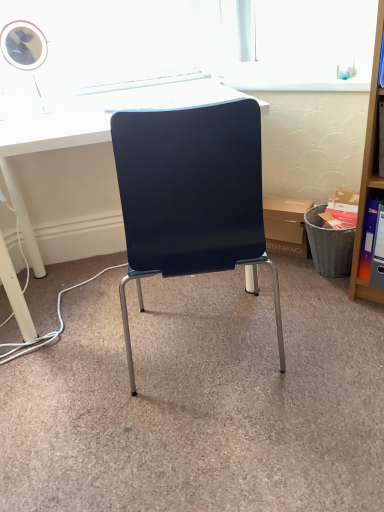
Measure the distance between wooden shelf at right and camera.

wooden shelf at right is 4.63 feet from camera.

Find the location of a particular element. white glossy desk at center is located at coordinates (103, 117).

Find the location of a particular element. wooden shelf at right is located at coordinates (369, 170).

What are the coordinates of `book above the matte cardboard box at center (from a real-world perspective)` in the screenshot? It's located at (369, 233).

Which is correct: matte cardboard box at center is inside orange plastic ring binder at right, or outside of it?

matte cardboard box at center is located beyond the bounds of orange plastic ring binder at right.

Could you tell me if matte cardboard box at center is facing orange plastic ring binder at right?

No, matte cardboard box at center is not facing towards orange plastic ring binder at right.

What's the angular difference between matte cardboard box at center and orange plastic ring binder at right's facing directions?

The angle between the facing direction of matte cardboard box at center and the facing direction of orange plastic ring binder at right is 0.168 degrees.

Is white glossy desk at center completely or partially outside of orange plastic ring binder at right?

Yes, white glossy desk at center is located beyond the bounds of orange plastic ring binder at right.

You are a GUI agent. You are given a task and a screenshot of the screen. Output one action in this format:
    pyautogui.click(x=<x>, y=<y>)
    Task: Click on the book below the white glossy desk at center (from a real-world perspective)
    
    Given the screenshot: What is the action you would take?
    pyautogui.click(x=369, y=233)

From the image's perspective, is white glossy desk at center above orange plastic ring binder at right?

Yes.

Is white glossy desk at center further to camera compared to orange plastic ring binder at right?

That is False.

Based on the photo, is orange plastic ring binder at right far away from matte cardboard box at center?

That's not correct — orange plastic ring binder at right is a little close to matte cardboard box at center.

Is the depth of orange plastic ring binder at right greater than that of matte cardboard box at center?

No.

From a real-world perspective, which object rests below the other?

matte cardboard box at center, from a real-world perspective.

Does orange plastic ring binder at right have a lesser width compared to matte cardboard box at center?

Correct, the width of orange plastic ring binder at right is less than that of matte cardboard box at center.

From the image's perspective, is matte cardboard box at center located above or below wooden shelf at right?

Based on their image positions, matte cardboard box at center is located beneath wooden shelf at right.

Between matte cardboard box at center and wooden shelf at right, which one has larger size?

With larger size is wooden shelf at right.

Based on the photo, from a real-world perspective, does matte cardboard box at center stand above wooden shelf at right?

No.

Considering the points (369, 292) and (293, 224), which point is in front, point (369, 292) or point (293, 224)?

The point (369, 292) is in front.

Considering the sizes of objects wooden shelf at right and matte cardboard box at center in the image provided, who is wider, wooden shelf at right or matte cardboard box at center?

With larger width is wooden shelf at right.

This screenshot has width=384, height=512. What are the coordinates of `box on the left of wooden shelf at right` in the screenshot? It's located at (285, 226).

What's the angular difference between wooden shelf at right and matte cardboard box at center's facing directions?

There is a 2.23-degree angle between the facing directions of wooden shelf at right and matte cardboard box at center.

How far apart are wooden shelf at right and white glossy desk at center?

wooden shelf at right and white glossy desk at center are 32.82 inches apart.

Is wooden shelf at right oriented away from white glossy desk at center?

wooden shelf at right does not have its back to white glossy desk at center.

Are wooden shelf at right and white glossy desk at center located far from each other?

wooden shelf at right is near white glossy desk at center, not far away.

Based on their positions, is wooden shelf at right located to the left or right of white glossy desk at center?

wooden shelf at right is positioned on white glossy desk at center's right side.

Looking at the image, does orange plastic ring binder at right seem bigger or smaller compared to white glossy desk at center?

Considering their sizes, orange plastic ring binder at right takes up less space than white glossy desk at center.

Is point (373, 233) farther from camera compared to point (37, 120)?

Yes, it is behind point (37, 120).

In the scene shown: Considering the relative positions of orange plastic ring binder at right and white glossy desk at center in the image provided, is orange plastic ring binder at right behind white glossy desk at center?

Yes, it is.

The width and height of the screenshot is (384, 512). I want to click on book above the matte cardboard box at center (from a real-world perspective), so click(369, 233).

Find the location of `desk in front of the orange plastic ring binder at right`. desk in front of the orange plastic ring binder at right is located at coordinates (103, 117).

Looking at the image, which one is located closer to wooden shelf at right, orange plastic ring binder at right or matte cardboard box at center?

The object closer to wooden shelf at right is orange plastic ring binder at right.

When comparing their distances from orange plastic ring binder at right, does wooden shelf at right or matte cardboard box at center seem further?

matte cardboard box at center is positioned further to the anchor orange plastic ring binder at right.

Considering their positions, is white glossy desk at center positioned closer to wooden shelf at right than matte cardboard box at center?

matte cardboard box at center.

From the image, which object appears to be nearer to matte cardboard box at center, white glossy desk at center or orange plastic ring binder at right?

orange plastic ring binder at right is positioned closer to the anchor matte cardboard box at center.

Which object lies further to the anchor point matte cardboard box at center, wooden shelf at right or white glossy desk at center?

white glossy desk at center is positioned further to the anchor matte cardboard box at center.

Based on their spatial positions, is matte cardboard box at center or orange plastic ring binder at right further from white glossy desk at center?

orange plastic ring binder at right is further to white glossy desk at center.

Considering their positions, is matte cardboard box at center positioned closer to orange plastic ring binder at right than wooden shelf at right?

wooden shelf at right is positioned closer to the anchor orange plastic ring binder at right.

Considering their positions, is wooden shelf at right positioned closer to matte cardboard box at center than orange plastic ring binder at right?

wooden shelf at right is positioned closer to the anchor matte cardboard box at center.

Identify the location of book located between white glossy desk at center and wooden shelf at right in the left-right direction. (369, 233).

The height and width of the screenshot is (512, 384). I want to click on box between white glossy desk at center and wooden shelf at right, so click(x=285, y=226).

Where is `box between white glossy desk at center and orange plastic ring binder at right from left to right`? This screenshot has height=512, width=384. box between white glossy desk at center and orange plastic ring binder at right from left to right is located at coordinates (285, 226).

I want to click on book positioned between wooden shelf at right and matte cardboard box at center from near to far, so click(x=369, y=233).